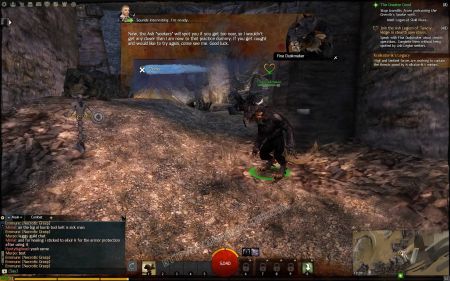
Locate an element on the screen. The height and width of the screenshot is (281, 450). lock is located at coordinates (311, 272).